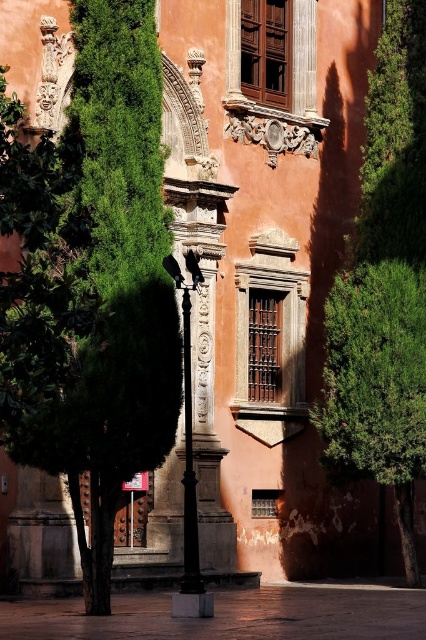
You are an architect examining the historic building. You notice the green leafy tree at right and the carved stone column at center. Which structure is taller?

The carved stone column at center is taller than the green leafy tree at right.

You are an architect examining the historic building. You notice the carved stone column at center and the polished metal pole at center. Which object is located higher up on the wall?

The carved stone column at center is positioned over the polished metal pole at center, so it is higher up on the wall.